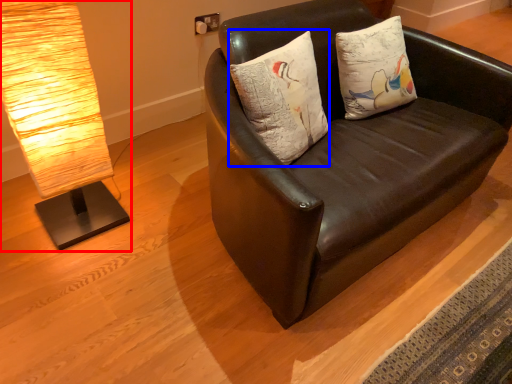
Question: Which object is closer to the camera taking this photo, lamp (highlighted by a red box) or pillow (highlighted by a blue box)?

Choices:
 (A) lamp
 (B) pillow

Answer: (A)